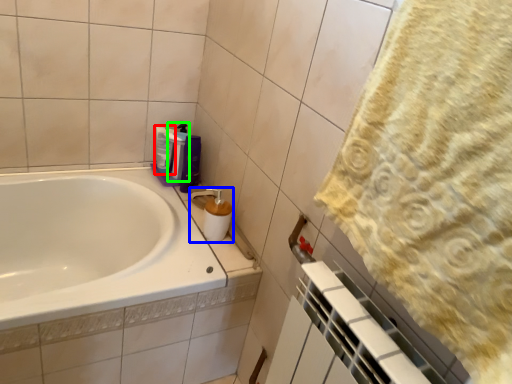
Question: Which object is the closest to the cleaning product (highlighted by a red box)? Choose among these: soap dispenser (highlighted by a blue box) or cleaning product (highlighted by a green box).

Choices:
 (A) soap dispenser
 (B) cleaning product

Answer: (B)